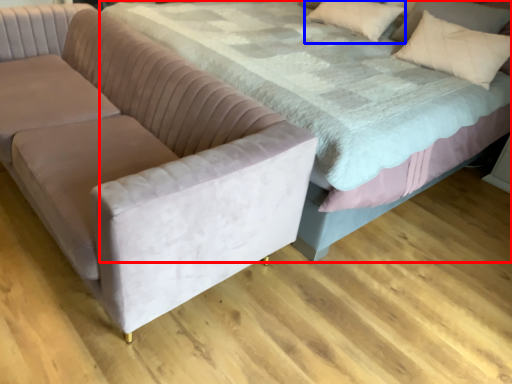
Question: Which object is closer to the camera taking this photo, bed (highlighted by a red box) or pillow (highlighted by a blue box)?

Choices:
 (A) bed
 (B) pillow

Answer: (A)